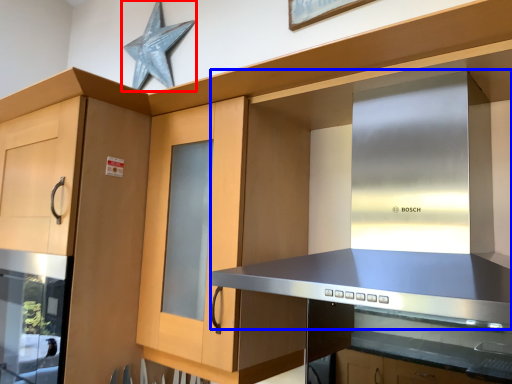
Question: Which of the following is the farthest to the observer, star (highlighted by a red box) or vent (highlighted by a blue box)?

Choices:
 (A) star
 (B) vent

Answer: (A)